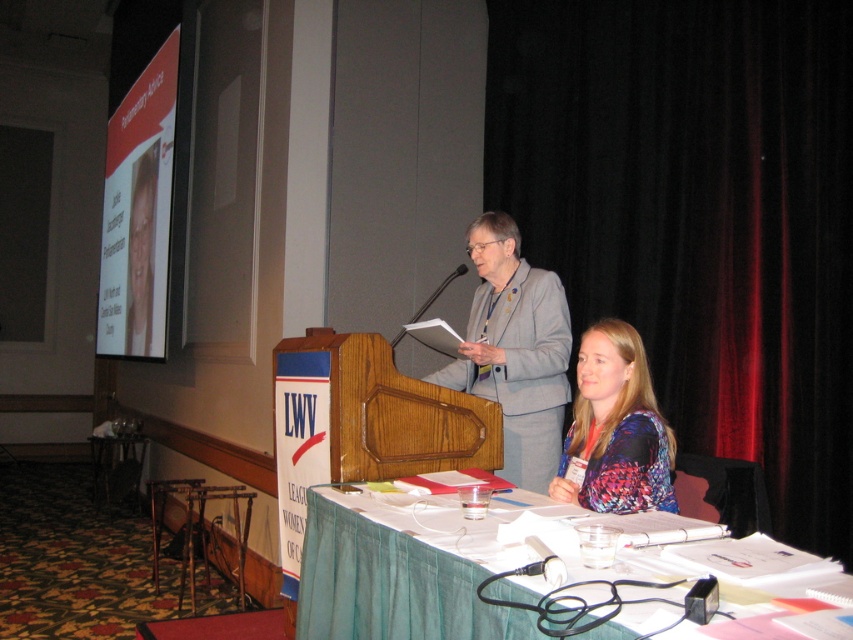
Question: Which of the following is the closest to the observer?

Choices:
 (A) gray fabric suit at center
 (B) black velvet curtain at upper right
 (C) multicolored fabric shirt at lower right
 (D) white glossy projector screen at upper left

Answer: (C)

Question: Estimate the real-world distances between objects in this image. Which object is closer to the white glossy projector screen at upper left?

Choices:
 (A) black plastic microphone at center
 (B) multicolored fabric shirt at lower right

Answer: (A)

Question: Can you confirm if green fabric table at lower center is smaller than white glossy projector screen at upper left?

Choices:
 (A) yes
 (B) no

Answer: (A)

Question: Considering the relative positions of black velvet curtain at upper right and gray fabric suit at center in the image provided, where is black velvet curtain at upper right located with respect to gray fabric suit at center?

Choices:
 (A) below
 (B) above

Answer: (B)

Question: Can you confirm if gray fabric suit at center is positioned to the left of white glossy projector screen at upper left?

Choices:
 (A) no
 (B) yes

Answer: (A)

Question: Which object appears closest to the camera in this image?

Choices:
 (A) green fabric table at lower center
 (B) gray fabric suit at center

Answer: (A)